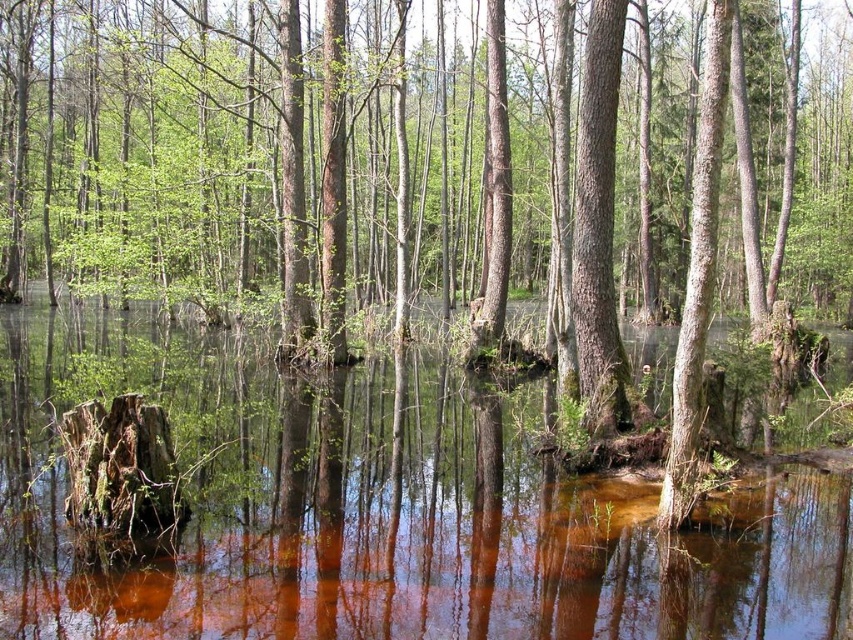
Looking at this image, you are a small animal trying to cross the swamp. You see a brown wood at center and a smooth brown tree trunk at center. Which one is closer to you?

Both the brown wood at center and the smooth brown tree trunk at center are exactly 13.85 feet apart from each other, so they are equally distant from you.

You are a nature photographer standing in the swamp and see the brown wood at center and the smooth brown tree trunk at center. Which object is closer to the water surface?

The brown wood at center is closer to the water surface because it is shorter than the smooth brown tree trunk at center.